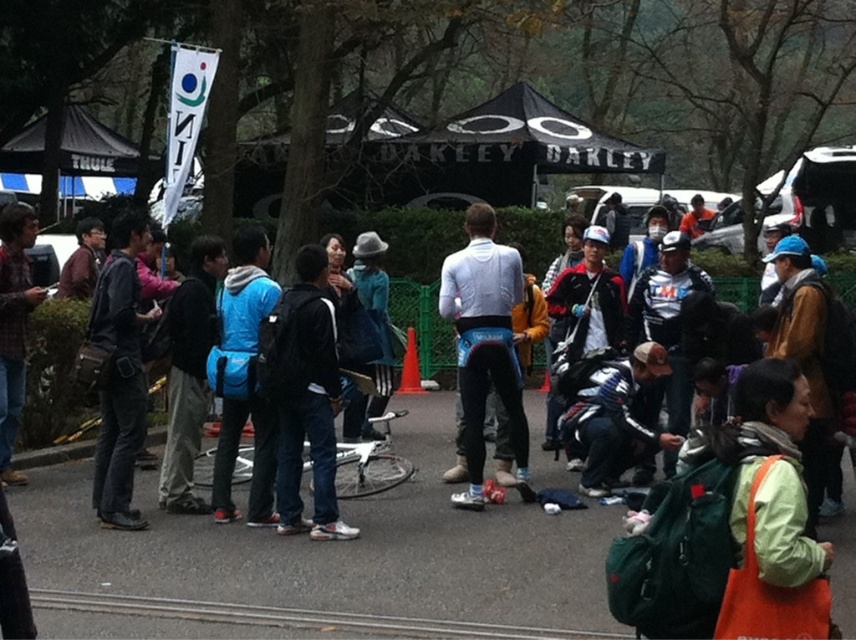
Which is in front, point (450, 262) or point (500, 625)?

Point (500, 625) is in front.

Does point (516, 460) come closer to viewer compared to point (528, 628)?

No, (516, 460) is behind (528, 628).

At what (x,y) coordinates should I click in order to perform the action: click on white matte cycling jersey at center. Please return your answer as a coordinate pair (x, y). The image size is (856, 640). Looking at the image, I should click on (484, 349).